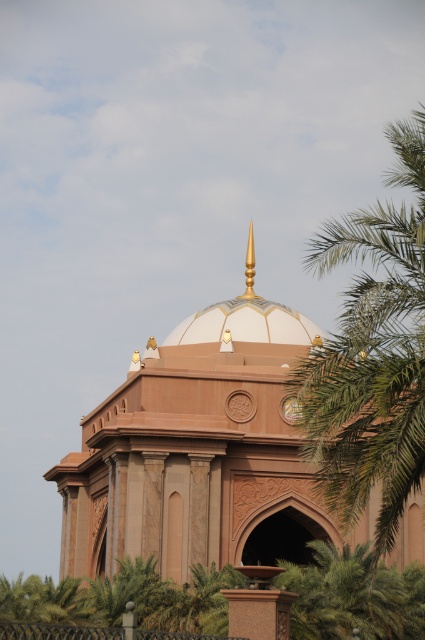
Between matte pink stone dome at center and green leafy palm tree at right, which one appears on the left side from the viewer's perspective?

From the viewer's perspective, matte pink stone dome at center appears more on the left side.

Is matte pink stone dome at center further to camera compared to green leafy palm tree at right?

That is True.

Between point (110, 513) and point (370, 458), which one is positioned behind?

Positioned behind is point (110, 513).

At what (x,y) coordinates should I click in order to perform the action: click on matte pink stone dome at center. Please return your answer as a coordinate pair (x, y). The width and height of the screenshot is (425, 640). Looking at the image, I should click on (198, 451).